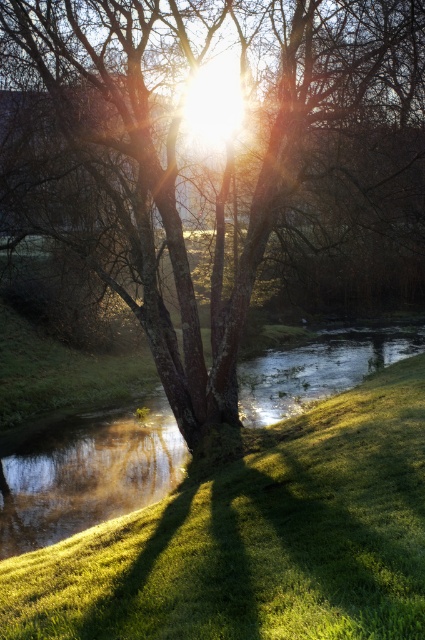
Question: Is smooth bark tree at center to the right of green grassy at center from the viewer's perspective?

Choices:
 (A) yes
 (B) no

Answer: (A)

Question: Does smooth bark tree at center have a lesser width compared to green grassy at center?

Choices:
 (A) no
 (B) yes

Answer: (A)

Question: Among these points, which one is nearest to the camera?

Choices:
 (A) (325, 112)
 (B) (411, 589)

Answer: (B)

Question: Which of the following is the closest to the observer?

Choices:
 (A) (374, 248)
 (B) (244, 592)

Answer: (B)

Question: Does smooth bark tree at center appear on the left side of green grassy at center?

Choices:
 (A) yes
 (B) no

Answer: (B)